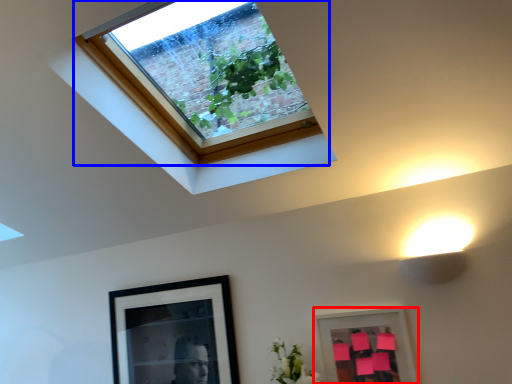
Question: Which object appears farthest to the camera in this image, picture frame (highlighted by a red box) or window (highlighted by a blue box)?

Choices:
 (A) picture frame
 (B) window

Answer: (A)